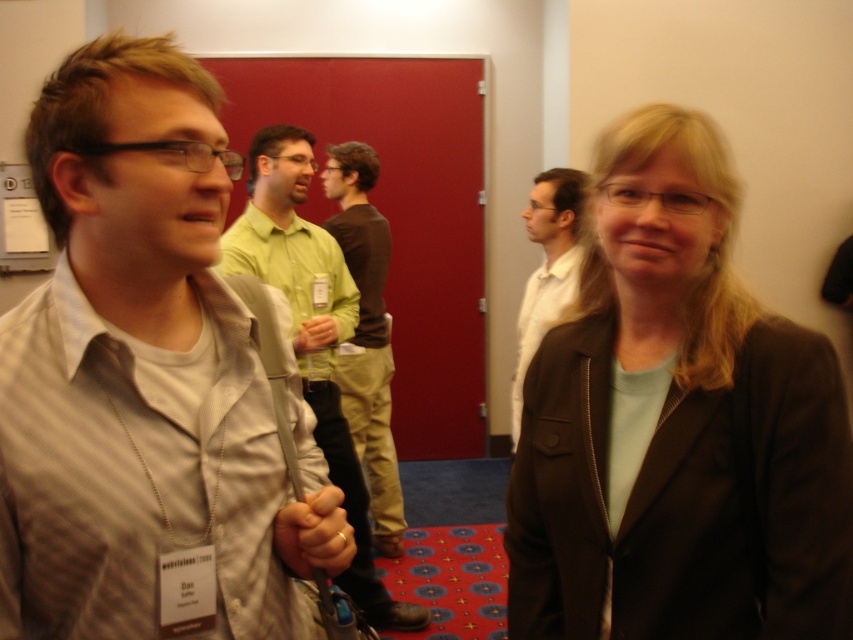
Question: Where is matte black blazer at center located in relation to light green shirt at center in the image?

Choices:
 (A) below
 (B) above

Answer: (B)

Question: Is light brown shirt at left below white shirt at center?

Choices:
 (A) no
 (B) yes

Answer: (A)

Question: Which point is closer to the camera taking this photo?

Choices:
 (A) (373, 465)
 (B) (525, 209)
 (C) (778, 561)
 (D) (306, 241)

Answer: (C)

Question: Which of the following is the closest to the observer?

Choices:
 (A) matte black blazer at center
 (B) brown cotton shirt at center
 (C) white shirt at center
 (D) light brown shirt at left

Answer: (D)

Question: Does light brown shirt at left appear over matte black blazer at center?

Choices:
 (A) yes
 (B) no

Answer: (A)

Question: Which object is positioned closest to the brown cotton shirt at center?

Choices:
 (A) light green shirt at center
 (B) matte black blazer at center
 (C) white shirt at center

Answer: (A)